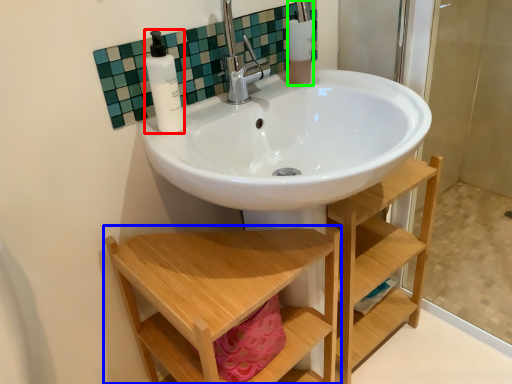
Question: Considering the real-world distances, which object is farthest from soap dispenser (highlighted by a red box)? furniture (highlighted by a blue box) or toiletry (highlighted by a green box)?

Choices:
 (A) furniture
 (B) toiletry

Answer: (A)